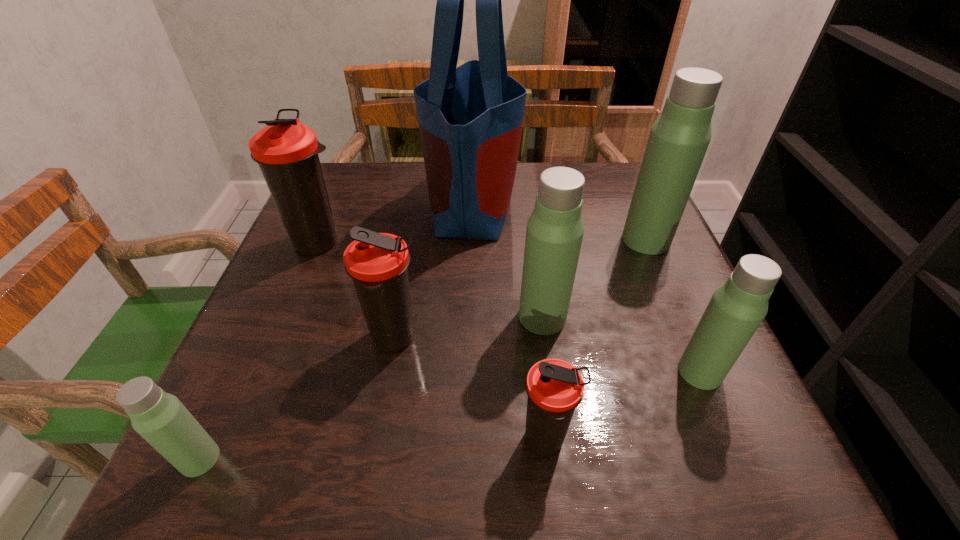
This screenshot has width=960, height=540. In the image, there is a desktop. Identify the location of vacant space at the far right corner. (592, 201).

You are a GUI agent. You are given a task and a screenshot of the screen. Output one action in this format:
    pyautogui.click(x=<x>, y=<y>)
    Task: Click on the blank region between the handbag and the third biggest light thermos bottle
    This screenshot has width=960, height=540.
    Given the screenshot: What is the action you would take?
    pyautogui.click(x=586, y=287)

Find the location of a particular element. free area in between the third farthest light thermos bottle and the leftmost light thermos bottle is located at coordinates (450, 415).

Find the location of a particular element. vacant space that's between the second farthest light thermos bottle and the second nearest light thermos bottle is located at coordinates (621, 345).

Locate an element on the screen. The height and width of the screenshot is (540, 960). empty space between the leftmost light thermos bottle and the third nearest light thermos bottle is located at coordinates (372, 388).

Identify the location of free spot between the smallest light thermos bottle and the red handbag. The width and height of the screenshot is (960, 540). (336, 331).

Locate an element on the screen. unoccupied position between the second farthest light thermos bottle and the third thermos bottle from left to right is located at coordinates (468, 328).

Image resolution: width=960 pixels, height=540 pixels. What are the coordinates of `free space that is in between the leftmost light thermos bottle and the red handbag` in the screenshot? It's located at (336, 331).

The width and height of the screenshot is (960, 540). Find the location of `empty location between the second nearest light thermos bottle and the tallest thermos bottle`. empty location between the second nearest light thermos bottle and the tallest thermos bottle is located at coordinates (673, 306).

Find the location of a particular element. The height and width of the screenshot is (540, 960). free area in between the second nearest light thermos bottle and the smallest brown thermos bottle is located at coordinates (623, 407).